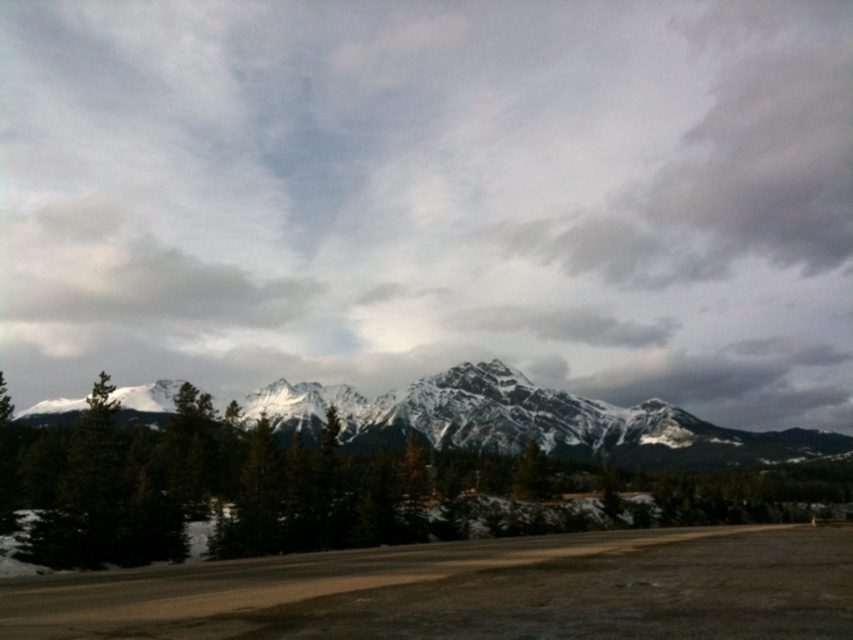
Between cloudy sky at upper center and green matte tree at left, which one has more height?

cloudy sky at upper center

Which of these two, cloudy sky at upper center or green matte tree at left, stands shorter?

With less height is green matte tree at left.

Find the location of `cloudy sky at upper center`. cloudy sky at upper center is located at coordinates (432, 196).

The height and width of the screenshot is (640, 853). Describe the element at coordinates (531, 420) in the screenshot. I see `snowy granite mountains at center` at that location.

Does snowy granite mountains at center have a greater height compared to green matte tree at left?

Correct, snowy granite mountains at center is much taller as green matte tree at left.

Locate an element on the screen. The width and height of the screenshot is (853, 640). snowy granite mountains at center is located at coordinates (531, 420).

Looking at this image, between cloudy sky at upper center and snowy granite mountains at center, which one is positioned higher?

cloudy sky at upper center is above.

Which is more to the right, cloudy sky at upper center or snowy granite mountains at center?

cloudy sky at upper center is more to the right.

Where is `cloudy sky at upper center`? cloudy sky at upper center is located at coordinates click(x=432, y=196).